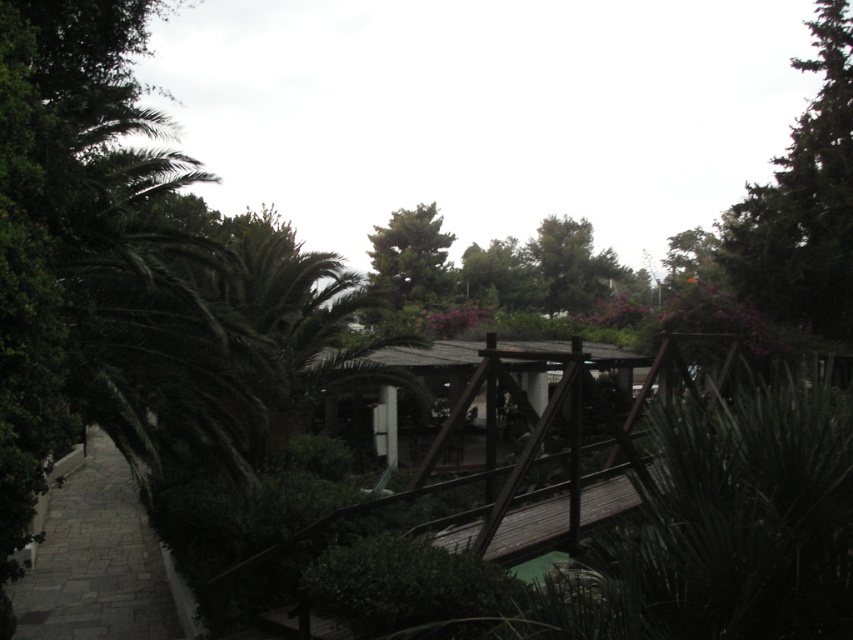
Does point (47, 561) lie behind point (390, 284)?

No, it is in front of (390, 284).

In the scene shown: Who is more forward, (32, 627) or (381, 257)?

Point (32, 627) is in front.

At what (x,y) coordinates should I click in order to perform the action: click on gray stone path at lower left. Please return your answer as a coordinate pair (x, y). Looking at the image, I should click on (96, 561).